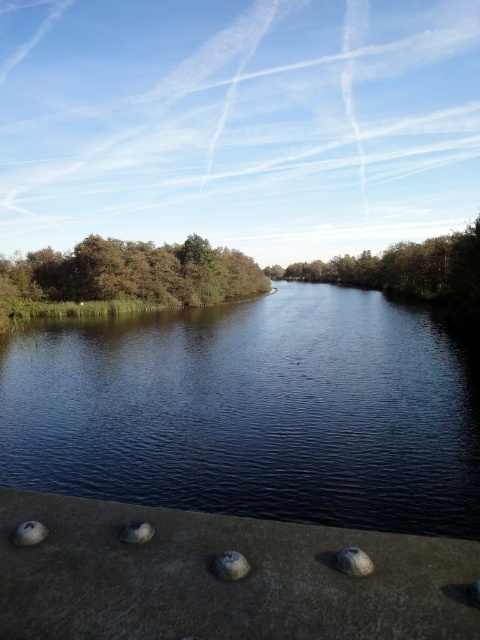
Does point (218, 572) come in front of point (132, 531)?

Yes, it is.

Does smooth gray stone at lower center appear on the right side of gray matte stone at lower left?

Yes, smooth gray stone at lower center is to the right of gray matte stone at lower left.

Is point (248, 572) positioned behind point (137, 524)?

No, it is not.

Identify the location of smooth gray stone at lower center. (230, 564).

Is point (76, 298) closer to viewer compared to point (120, 532)?

No.

What do you see at coordinates (135, 273) in the screenshot? I see `green leafy trees at left` at bounding box center [135, 273].

At what (x,y) coordinates should I click in order to perform the action: click on green leafy trees at left. Please return your answer as a coordinate pair (x, y). The image size is (480, 640). Looking at the image, I should click on pyautogui.click(x=135, y=273).

Is point (52, 468) positioned behind point (371, 563)?

That is True.

This screenshot has height=640, width=480. What do you see at coordinates (252, 412) in the screenshot? I see `dark blue water at center` at bounding box center [252, 412].

Where is `dark blue water at center`? The image size is (480, 640). dark blue water at center is located at coordinates (252, 412).